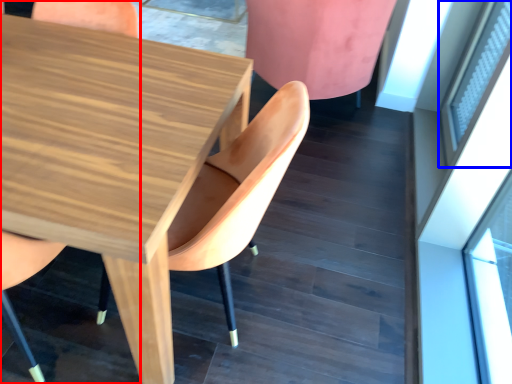
Question: Among these objects, which one is farthest to the camera, chair (highlighted by a red box) or window (highlighted by a blue box)?

Choices:
 (A) chair
 (B) window

Answer: (B)